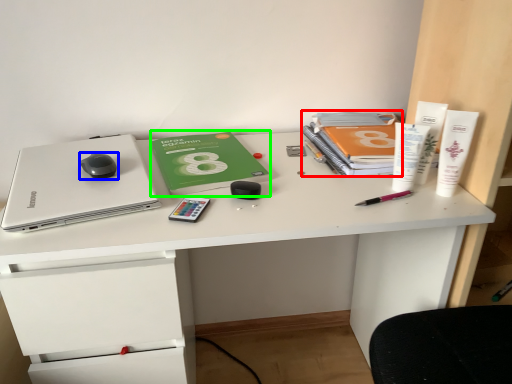
Question: Considering the real-world distances, which object is closest to paperback book (highlighted by a red box)? mouse (highlighted by a blue box) or paperback book (highlighted by a green box).

Choices:
 (A) mouse
 (B) paperback book

Answer: (B)